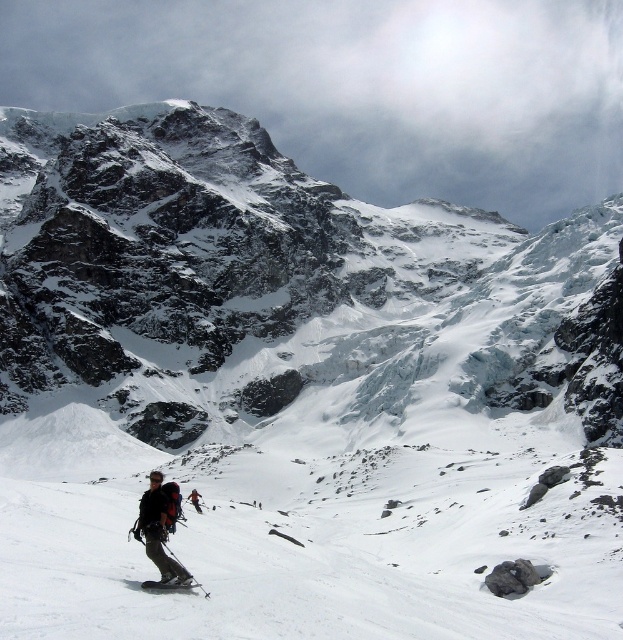
Question: Which is nearer to the dark gray ski suit at lower left?

Choices:
 (A) dark gray fabric backpack at lower center
 (B) black matte ski at lower center

Answer: (A)

Question: Which object is positioned farthest from the dark gray fabric backpack at lower center?

Choices:
 (A) dark gray ski suit at lower left
 (B) black matte ski at lower center

Answer: (A)

Question: Is dark gray fabric backpack at lower center bigger than black matte ski at lower center?

Choices:
 (A) yes
 (B) no

Answer: (A)

Question: Considering the real-world distances, which object is farthest from the black matte ski at lower center?

Choices:
 (A) dark gray fabric backpack at lower center
 (B) dark gray ski suit at lower left

Answer: (B)

Question: Can you confirm if black matte ski at lower center is wider than dark gray ski suit at lower left?

Choices:
 (A) no
 (B) yes

Answer: (B)

Question: Does dark gray fabric backpack at lower center have a smaller size compared to black matte ski at lower center?

Choices:
 (A) yes
 (B) no

Answer: (B)